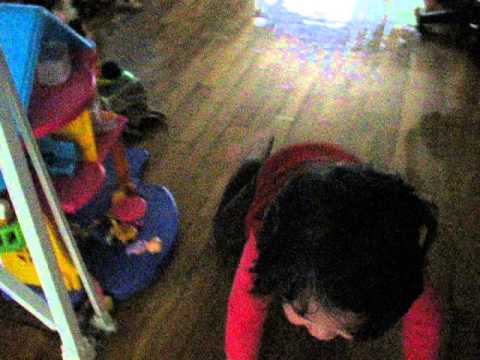
The width and height of the screenshot is (480, 360). I want to click on pink upper floor of doll house, so click(x=59, y=108).